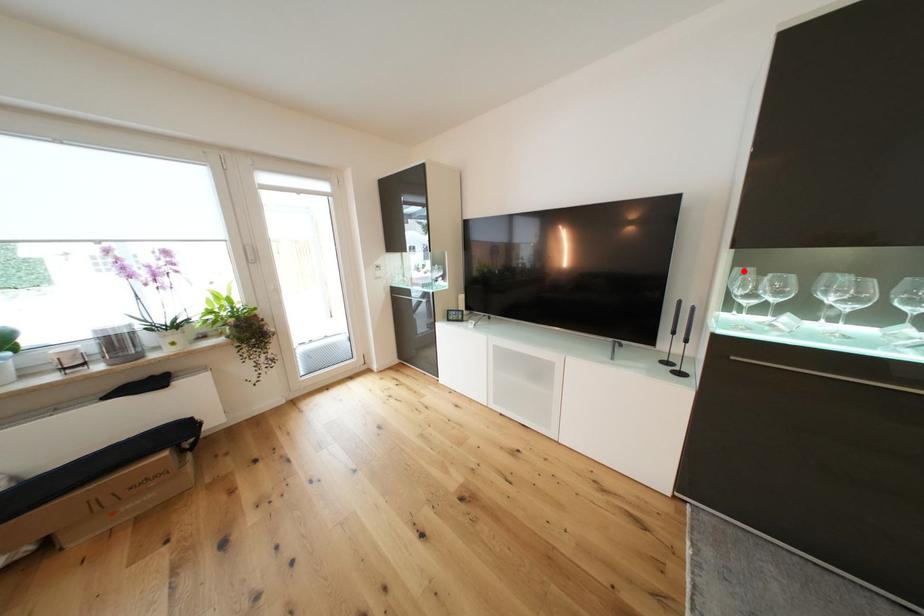
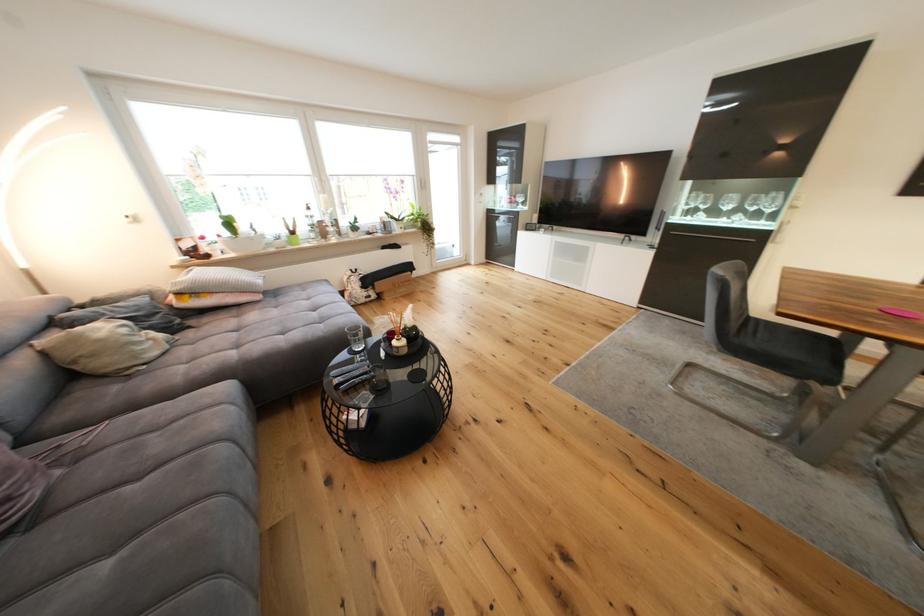
Locate, in the second image, the point that corresponds to the highlighted location in the first image.

(701, 195)